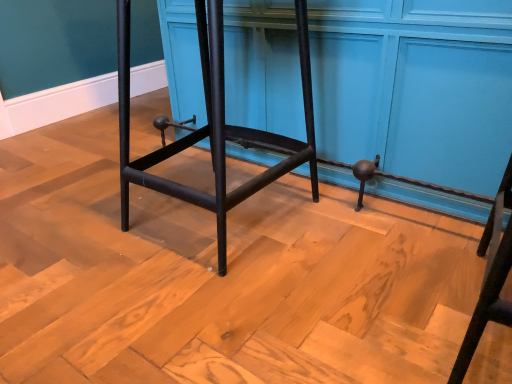
Find the location of a particular element. vacant space underneath black metal stool at center (from a real-world perspective) is located at coordinates click(x=214, y=216).